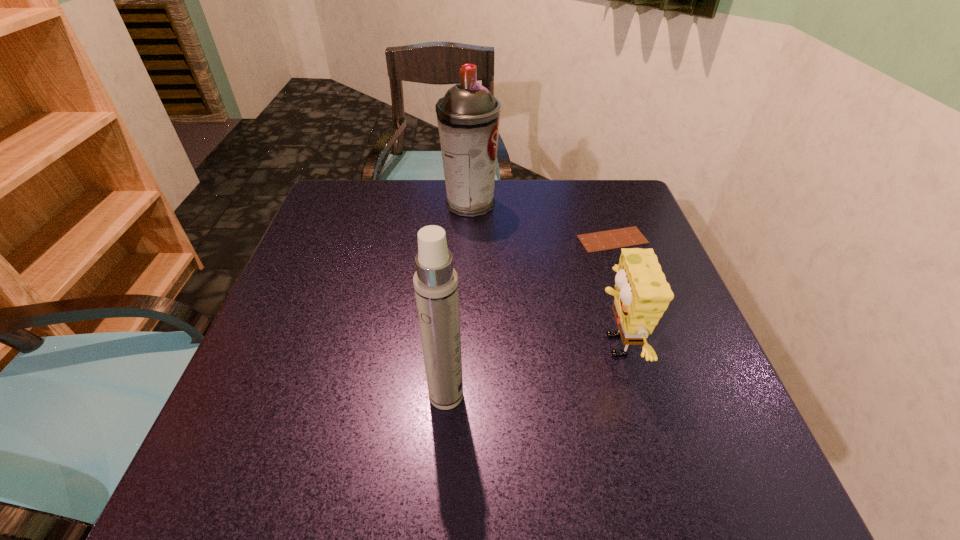
This screenshot has height=540, width=960. In the image, there is a desktop. Identify the location of vacant space at the far right corner. (574, 188).

Identify the location of vacant point located between the farthest object and the chocolate bar. point(541,222).

Image resolution: width=960 pixels, height=540 pixels. Identify the location of empty space between the farther aerosol can and the second shortest object. (541, 275).

Image resolution: width=960 pixels, height=540 pixels. Identify the location of free area in between the nearer aerosol can and the third nearest object. (529, 318).

Image resolution: width=960 pixels, height=540 pixels. What are the coordinates of `vacant space that's between the sponge and the nearer aerosol can` in the screenshot? It's located at (530, 370).

Identify the location of free space between the shortest object and the nearer aerosol can. This screenshot has height=540, width=960. point(529,318).

This screenshot has height=540, width=960. In order to click on empty space between the nearer aerosol can and the sponge in this screenshot , I will do `click(530, 370)`.

Identify the location of vacant area between the farthest object and the third tallest object. Image resolution: width=960 pixels, height=540 pixels. (541, 275).

Identify which object is the third closest to the chocolate bar. Please provide its 2D coordinates. Your answer should be formatted as a tuple, i.e. [(x, y)], where the tuple contains the x and y coordinates of a point satisfying the conditions above.

[(435, 281)]

Locate an element on the screen. The width and height of the screenshot is (960, 540). object that stands as the second closest to the farthest object is located at coordinates (642, 294).